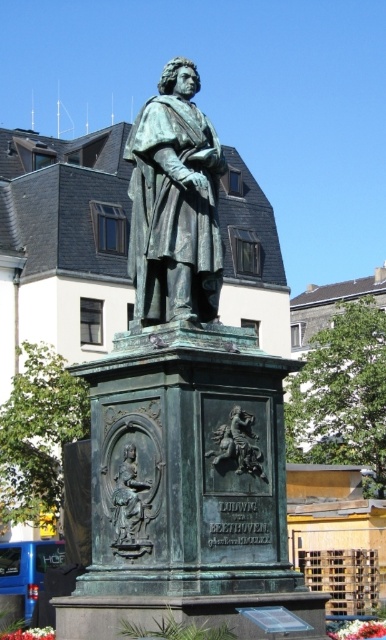
Which is more to the left, bronze statue at center or bronze relief figure at center?

bronze relief figure at center is more to the left.

Is bronze statue at center thinner than bronze relief figure at center?

No.

Is point (213, 310) positioned in front of point (126, 528)?

No, it is not.

Locate an element on the screen. bronze statue at center is located at coordinates (174, 204).

Is bronze statue at center above bronze relief horse at center?

Indeed, bronze statue at center is positioned over bronze relief horse at center.

Is point (213, 241) less distant than point (225, 426)?

No, (213, 241) is further to viewer.

Image resolution: width=386 pixels, height=640 pixels. Identify the location of bronze statue at center. (174, 204).

Can you confirm if bronze relief figure at center is bigger than bronze relief horse at center?

No, bronze relief figure at center is not bigger than bronze relief horse at center.

Looking at this image, is bronze relief figure at center closer to the viewer compared to bronze relief horse at center?

That is True.

Does point (135, 518) come behind point (231, 442)?

No, it is not.

Locate an element on the screen. The image size is (386, 640). bronze relief figure at center is located at coordinates (128, 500).